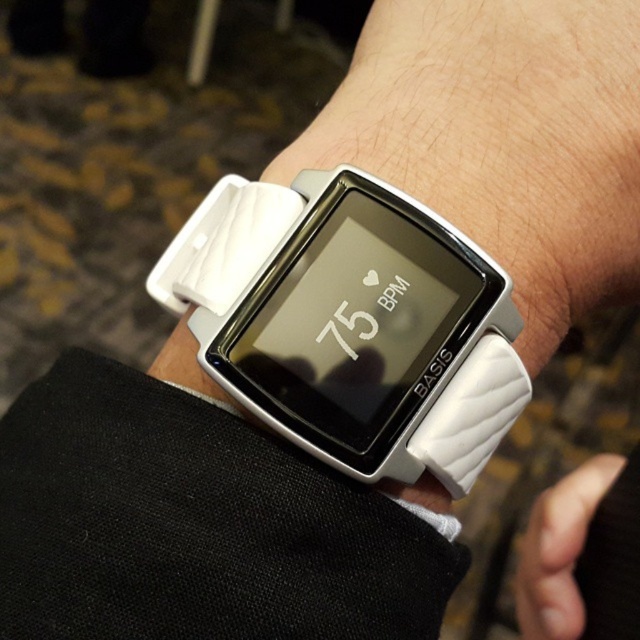
Is point (371, 440) farther from viewer compared to point (602, 600)?

No, it is not.

Between white rubber watch at center and white matte wristwatch at center, which one appears on the left side from the viewer's perspective?

Positioned to the left is white rubber watch at center.

Is point (483, 433) behind point (584, 486)?

That is False.

The width and height of the screenshot is (640, 640). I want to click on white rubber watch at center, so click(349, 323).